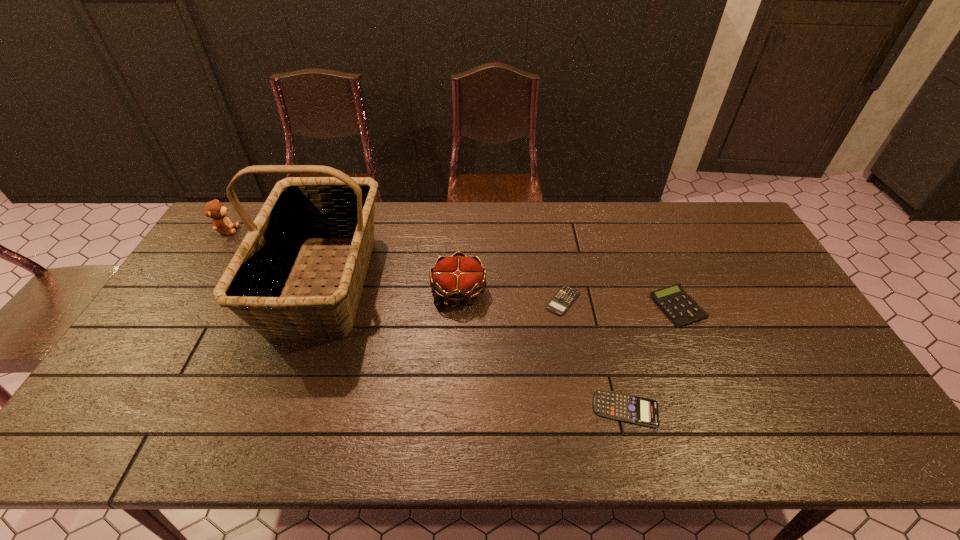
You are a GUI agent. You are given a task and a screenshot of the screen. Output one action in this format:
    pyautogui.click(x=<x>, y=<y>)
    Task: Click on the unoccupied position between the second shortest object and the crown
    The height and width of the screenshot is (540, 960).
    Given the screenshot: What is the action you would take?
    click(542, 350)

Image resolution: width=960 pixels, height=540 pixels. Identify the location of blank region between the shortest calculator and the third tallest object. (511, 296).

Locate an element on the screen. The image size is (960, 540). unoccupied position between the basket and the fourth shortest object is located at coordinates [392, 287].

The width and height of the screenshot is (960, 540). Find the location of `the fourth closest object relative to the second tallest calculator`. the fourth closest object relative to the second tallest calculator is located at coordinates (299, 211).

Locate which object ranks fifth in proximity to the leftmost object. Please provide its 2D coordinates. Your answer should be formatted as a tuple, i.e. [(x, y)], where the tuple contains the x and y coordinates of a point satisfying the conditions above.

[(678, 306)]

Select which calculator appears as the second closest to the third object from left to right. Please provide its 2D coordinates. Your answer should be formatted as a tuple, i.e. [(x, y)], where the tuple contains the x and y coordinates of a point satisfying the conditions above.

[(638, 410)]

Where is `calculator that stands as the second closest to the nearest calculator`? The width and height of the screenshot is (960, 540). calculator that stands as the second closest to the nearest calculator is located at coordinates (565, 296).

Find the location of a particular element. The width and height of the screenshot is (960, 540). vacant space that satisfies the following two spatial constraints: 1. on the face of the fourth shortest object; 2. on the right side of the leftmost object is located at coordinates (188, 291).

Where is `free location that satisfies the following two spatial constraints: 1. on the front side of the shortest object; 2. on the left side of the fourth tallest object`? free location that satisfies the following two spatial constraints: 1. on the front side of the shortest object; 2. on the left side of the fourth tallest object is located at coordinates (564, 307).

Where is `vacant space that satisfies the following two spatial constraints: 1. on the back side of the shortest calculator; 2. on the face of the leftmost object`? vacant space that satisfies the following two spatial constraints: 1. on the back side of the shortest calculator; 2. on the face of the leftmost object is located at coordinates (550, 230).